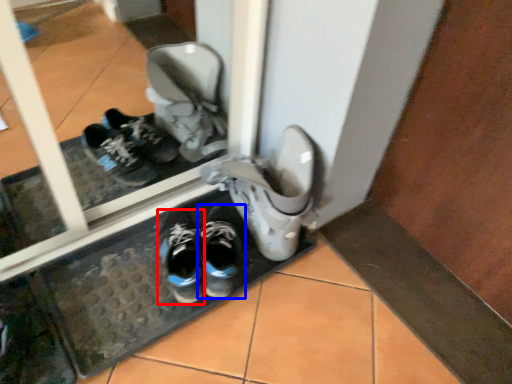
Question: Which object appears farthest to the camera in this image, running shoe (highlighted by a red box) or footwear (highlighted by a blue box)?

Choices:
 (A) running shoe
 (B) footwear

Answer: (B)